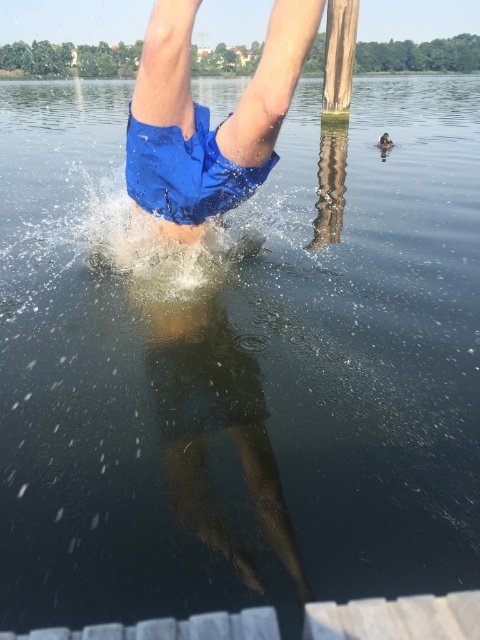
You are observing a diver jumping into the water. You notice two points marked in the image. The first point is at coordinates point [248,168] and the second point is at point [327,106]. From your perspective, which point is closer to you?

Point [248,168] is in front of point [327,106], so it is closer to you.

You are a photographer trying to capture the splash from the dive. You notice the blue fabric shorts at center and the green wood pole at upper center. Which object is closer to the camera lens?

The blue fabric shorts at center are closer to the camera lens because they are in front of the green wood pole at upper center.

You are a photographer trying to capture the splash from the blue fabric shorts at center and the green wood pole at upper center. Which object is wider in the image?

The blue fabric shorts at center might be wider than green wood pole at upper center.